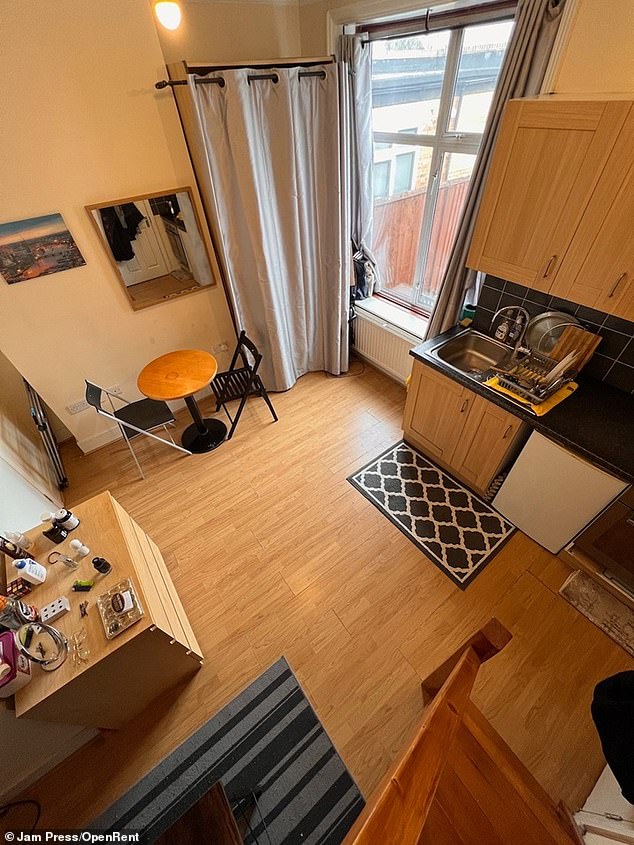
In order to click on cabinet door in this screenshot , I will do `click(423, 409)`, `click(467, 422)`, `click(515, 217)`, `click(581, 242)`.